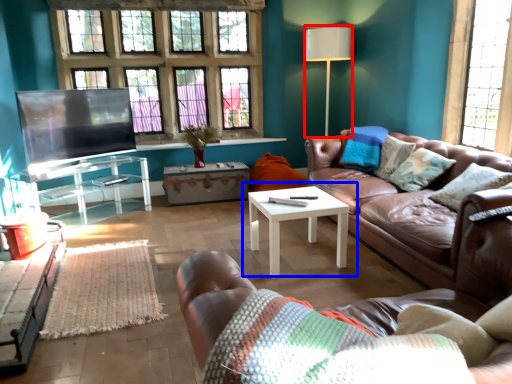
Question: Which object appears farthest to the camera in this image, lamp (highlighted by a red box) or coffee table (highlighted by a blue box)?

Choices:
 (A) lamp
 (B) coffee table

Answer: (A)